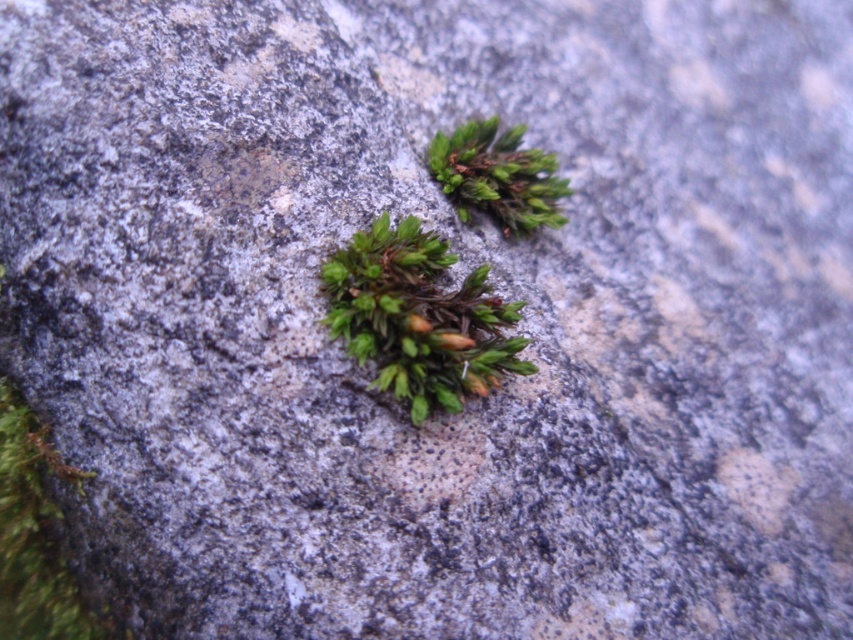
Does green fuzzy moss at center appear over green fuzzy moss at upper center?

No, green fuzzy moss at center is not above green fuzzy moss at upper center.

Is green fuzzy moss at center positioned before green fuzzy moss at upper center?

Yes.

Describe the element at coordinates (418, 317) in the screenshot. I see `green fuzzy moss at center` at that location.

Identify the location of green fuzzy moss at center. (418, 317).